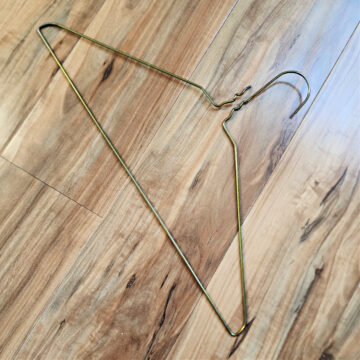
Image resolution: width=360 pixels, height=360 pixels. I want to click on middle of the joint between wood slats on left, so click(43, 182).